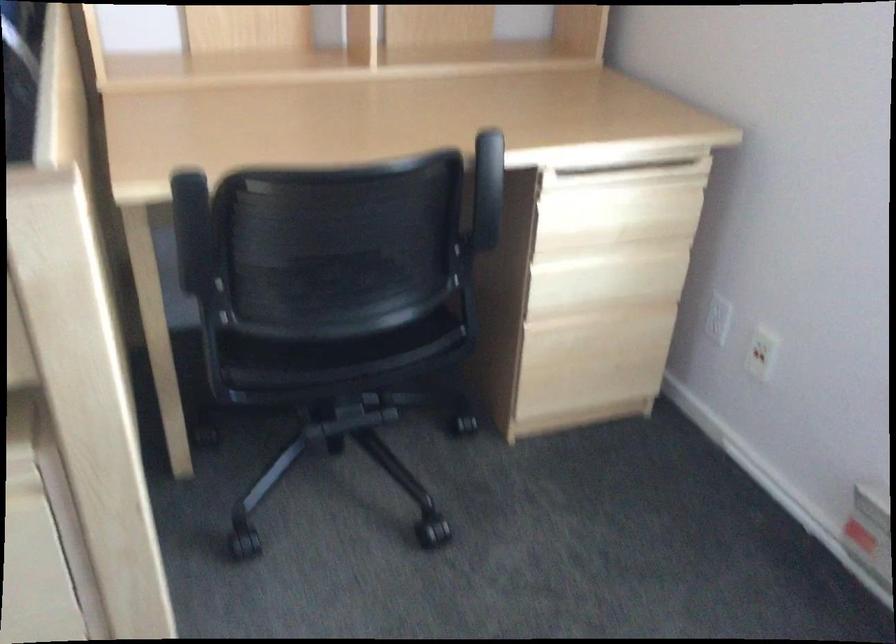
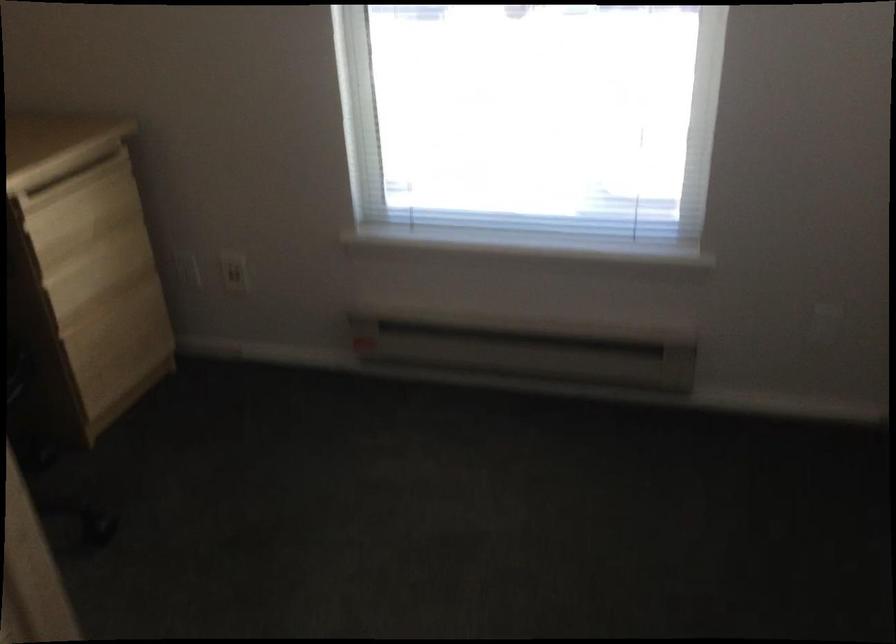
Question: The camera is either moving clockwise (left) or counter-clockwise (right) around the object. The first image is from the beginning of the video and the second image is from the end. Is the camera moving left or right when shooting the video?

Choices:
 (A) Left
 (B) Right

Answer: (A)